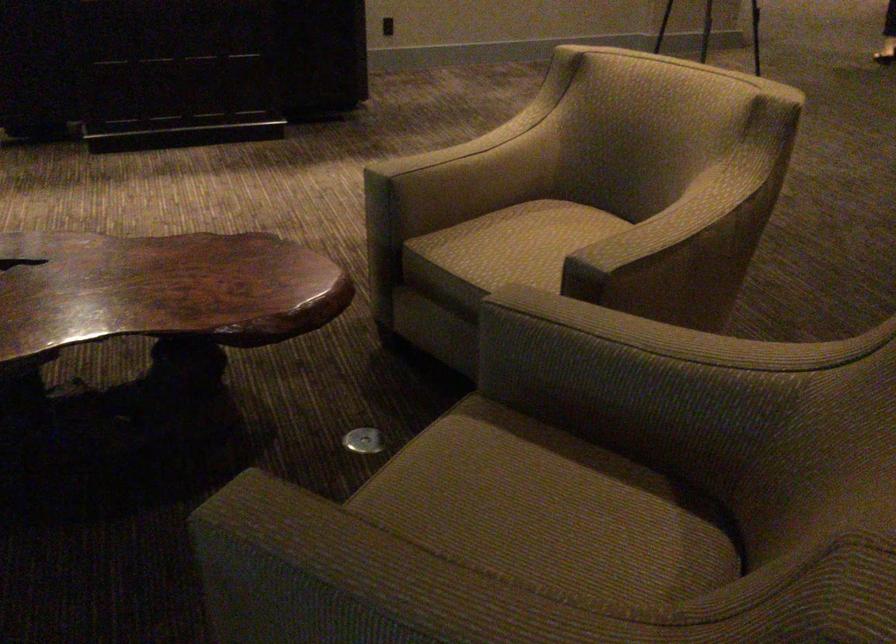
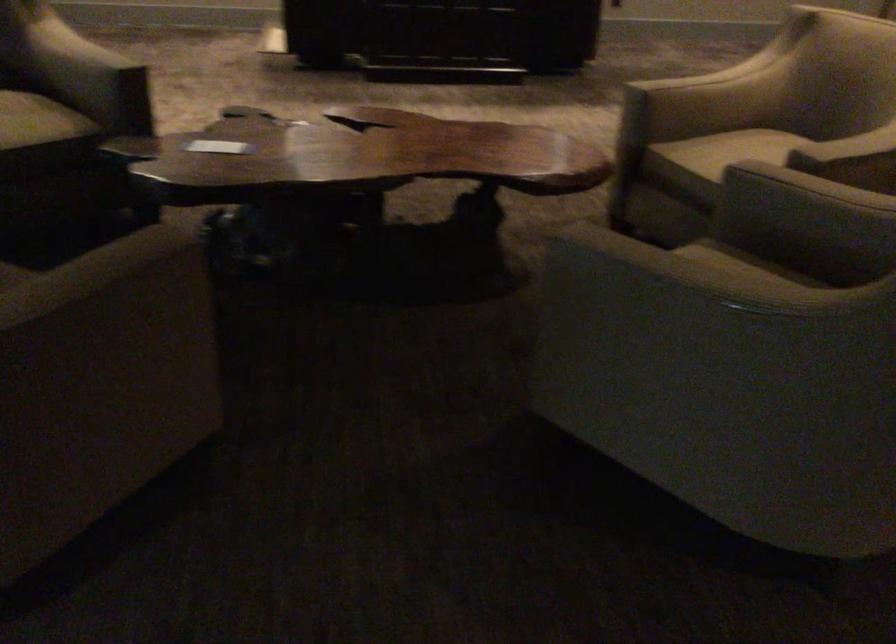
Find the pixel in the second image that matches [411,571] in the first image.

(690, 268)